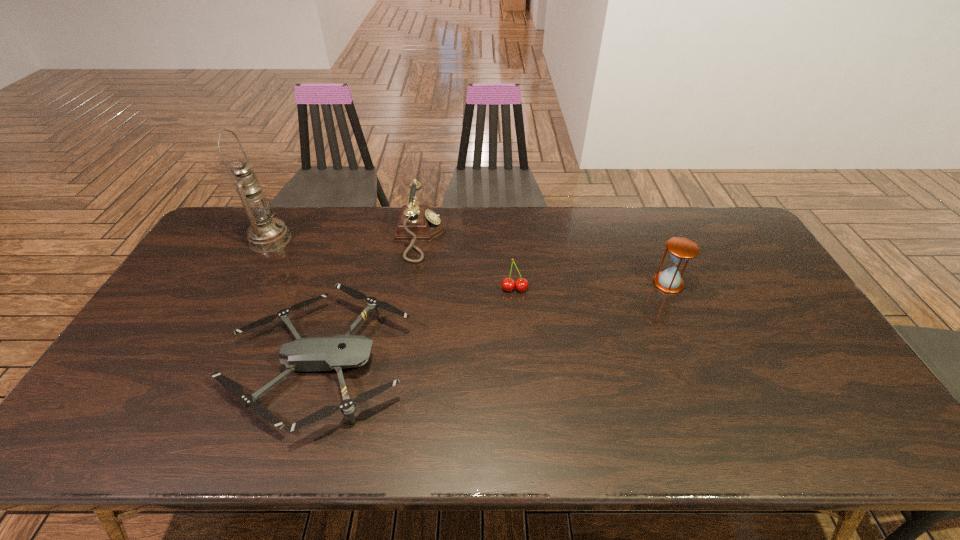
You are a GUI agent. You are given a task and a screenshot of the screen. Output one action in this format:
    pyautogui.click(x=<x>, y=<y>)
    Task: Click on the vacant space that is in between the second shortest object and the drone
    Image resolution: width=960 pixels, height=540 pixels.
    Given the screenshot: What is the action you would take?
    pyautogui.click(x=417, y=326)

Locate an element on the screen. free space between the tallest object and the nearest object is located at coordinates (295, 301).

Find the location of `object that is the closest one to the oil lamp`. object that is the closest one to the oil lamp is located at coordinates [338, 352].

Where is `object that stands as the closest to the telephone`? This screenshot has width=960, height=540. object that stands as the closest to the telephone is located at coordinates (338, 352).

Where is `free location that satisfies the following two spatial constraints: 1. with the stems of the fourth tallest object pointing upwards; 2. with a camera mounted on the front of the nearest object`? free location that satisfies the following two spatial constraints: 1. with the stems of the fourth tallest object pointing upwards; 2. with a camera mounted on the front of the nearest object is located at coordinates (520, 362).

What are the coordinates of `vacant space that satisfies the following two spatial constraints: 1. on the dial of the rightmost object; 2. on the right side of the telephone` in the screenshot? It's located at (413, 283).